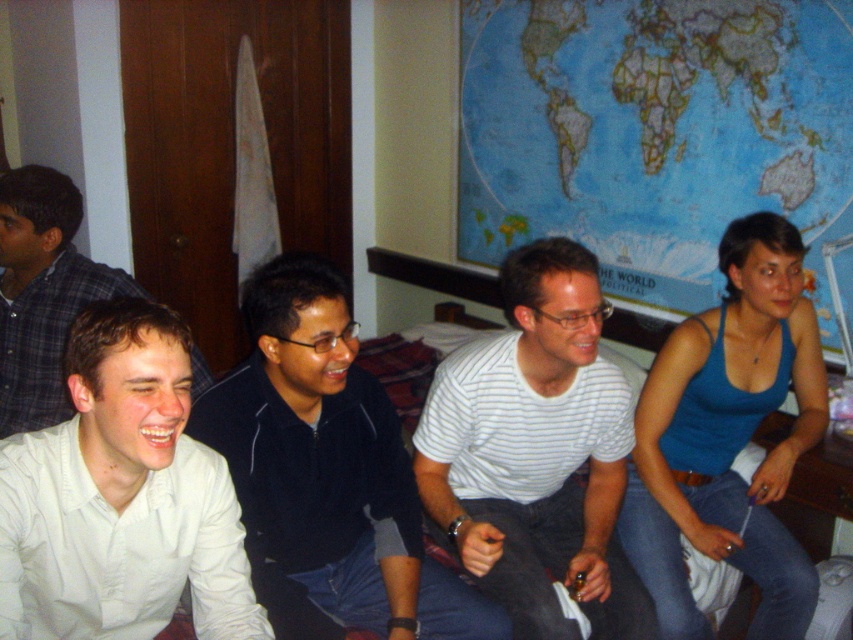
Identify the location of blue paper map at upper center. (654, 132).

Is blue paper map at upper center smaller than white striped shirt at center?

No, blue paper map at upper center is not smaller than white striped shirt at center.

Is point (592, 1) positioned in front of point (613, 445)?

That is False.

Where is `blue paper map at upper center`? The image size is (853, 640). blue paper map at upper center is located at coordinates (654, 132).

Describe the element at coordinates (654, 132) in the screenshot. I see `blue paper map at upper center` at that location.

From the picture: Who is more distant from viewer, (788, 193) or (155, 579)?

Point (788, 193)

Is point (630, 186) in front of point (65, 516)?

No, (630, 186) is further to viewer.

Find the location of a particular element. blue paper map at upper center is located at coordinates (654, 132).

Is the position of white shirt at center less distant than that of white shirt at left?

Yes, it is in front of white shirt at left.

Between point (114, 349) and point (33, 257), which one is positioned in front?

Point (114, 349) is more forward.

Does point (56, 452) lie in front of point (44, 173)?

Yes, point (56, 452) is closer to viewer.

Image resolution: width=853 pixels, height=640 pixels. Find the location of `white shirt at center`. white shirt at center is located at coordinates (120, 497).